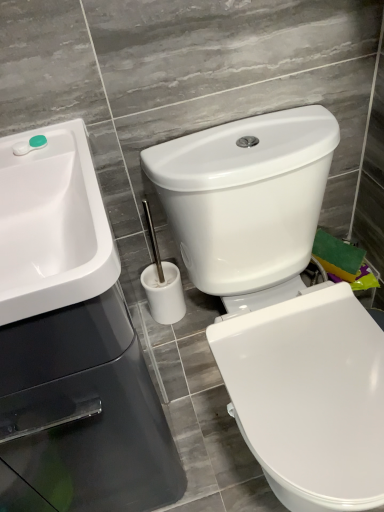
Question: Can you confirm if green plastic container at upper left is positioned to the left of white glossy toilet at center?

Choices:
 (A) yes
 (B) no

Answer: (A)

Question: Is green plastic container at upper left positioned in front of white glossy toilet at center?

Choices:
 (A) no
 (B) yes

Answer: (A)

Question: Is green plastic container at upper left next to white glossy toilet at center and touching it?

Choices:
 (A) no
 (B) yes

Answer: (A)

Question: Considering the relative sizes of green plastic container at upper left and white glossy toilet at center in the image provided, is green plastic container at upper left wider than white glossy toilet at center?

Choices:
 (A) yes
 (B) no

Answer: (B)

Question: From the image's perspective, is green plastic container at upper left on white glossy toilet at center?

Choices:
 (A) no
 (B) yes

Answer: (B)

Question: From the image's perspective, is white glossy sink at upper left located above or below green plastic container at upper left?

Choices:
 (A) above
 (B) below

Answer: (B)

Question: From a real-world perspective, is white glossy sink at upper left above or below green plastic container at upper left?

Choices:
 (A) below
 (B) above

Answer: (A)

Question: From their relative heights in the image, would you say white glossy sink at upper left is taller or shorter than green plastic container at upper left?

Choices:
 (A) tall
 (B) short

Answer: (A)

Question: Relative to green plastic container at upper left, is white glossy sink at upper left in front or behind?

Choices:
 (A) behind
 (B) front

Answer: (B)

Question: Which is correct: green plastic container at upper left is inside white glossy toilet at center, or outside of it?

Choices:
 (A) inside
 (B) outside

Answer: (B)

Question: In the image, is green plastic container at upper left positioned in front of or behind white glossy toilet at center?

Choices:
 (A) behind
 (B) front

Answer: (A)

Question: In the image, is green plastic container at upper left on the left side or the right side of white glossy toilet at center?

Choices:
 (A) left
 (B) right

Answer: (A)

Question: Is point (18, 153) closer or farther from the camera than point (329, 340)?

Choices:
 (A) farther
 (B) closer

Answer: (B)

Question: In terms of height, does white glossy toilet at center look taller or shorter compared to white glossy sink at upper left?

Choices:
 (A) tall
 (B) short

Answer: (A)

Question: From the image's perspective, relative to white glossy sink at upper left, is white glossy toilet at center above or below?

Choices:
 (A) below
 (B) above

Answer: (A)